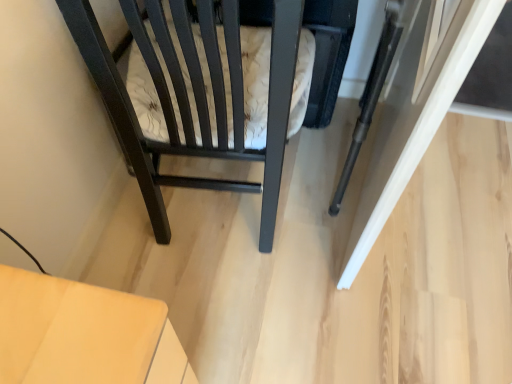
Find the location of a particular element. matte black chair at center is located at coordinates (195, 98).

This screenshot has width=512, height=384. What do you see at coordinates (195, 98) in the screenshot? I see `matte black chair at center` at bounding box center [195, 98].

This screenshot has height=384, width=512. In order to click on matte black chair at center in this screenshot , I will do `click(195, 98)`.